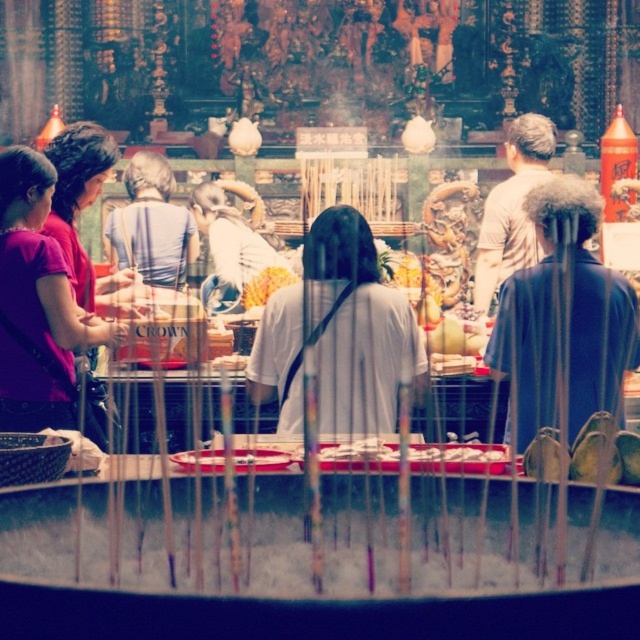
You are standing in the temple and need to locate the matte purple shirt at left. According to the scene description, where should you look to find it?

The matte purple shirt at left is located at the 2D coordinates point (x=38, y=308).

Looking at this image, you are a photographer taking a picture of the altar. You notice the matte purple shirt at left and the yellow flower at center in your shot. Which object should you adjust your focus on if you want to ensure both are in frame but prioritize the taller one?

The matte purple shirt at left is taller than the yellow flower at center, so you should adjust your focus on the matte purple shirt at left to prioritize it while keeping both in frame.

You are a photographer trying to capture both the matte purple shirt at left and the yellow flower at center in a single frame. Since you want both to be clearly visible, which object should you focus on first to ensure proper focus, considering their sizes?

The matte purple shirt at left is bigger than the yellow flower at center, so you should focus on the matte purple shirt at left first to ensure it is in clear focus, then adjust for the smaller yellow flower at center if needed.